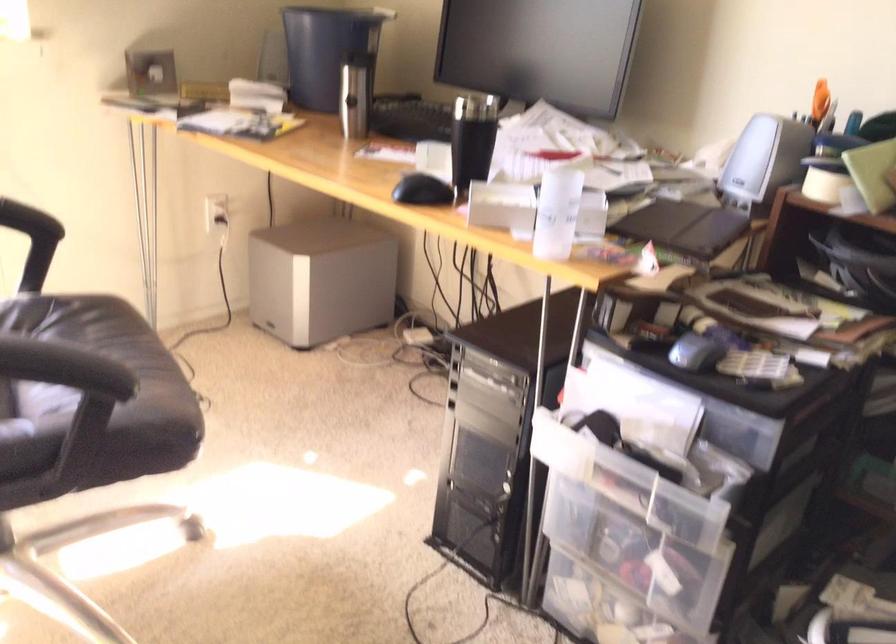
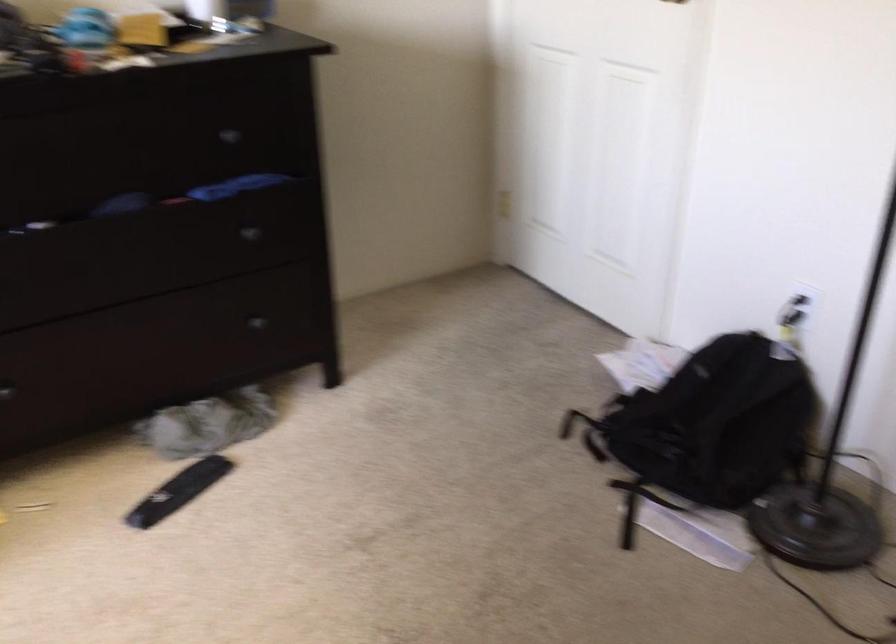
Based on the continuous images, in which direction is the camera rotating?

The camera's rotation is toward right-down.